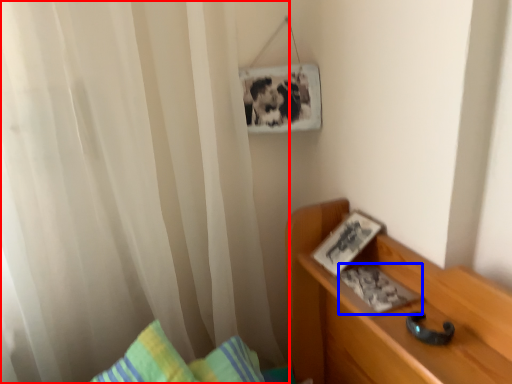
Question: Which point is further to the camera, curtain (highlighted by a red box) or book (highlighted by a blue box)?

Choices:
 (A) curtain
 (B) book

Answer: (B)